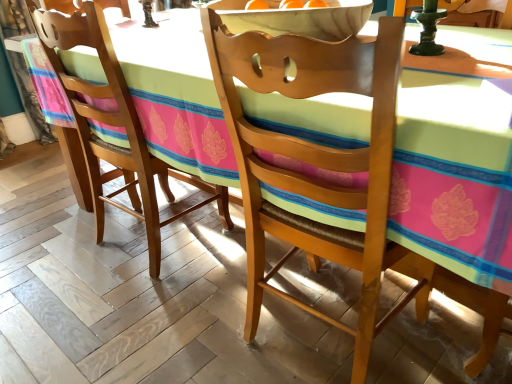
Question: From the image's perspective, is wooden chair at center, the 1th chair viewed from the right, located above or below matte wood chair at lower left, acting as the first chair starting from the left?

Choices:
 (A) above
 (B) below

Answer: (B)

Question: Relative to matte wood chair at lower left, the 2th chair in the right-to-left sequence, is wooden chair at center, the 2th chair viewed from the left, in front or behind?

Choices:
 (A) front
 (B) behind

Answer: (A)

Question: From a real-world perspective, is wooden chair at center, the 2th chair viewed from the left, physically located above or below matte wood chair at lower left, acting as the first chair starting from the left?

Choices:
 (A) above
 (B) below

Answer: (B)

Question: Is matte wood chair at lower left, the 2th chair in the right-to-left sequence, bigger or smaller than wooden chair at center, the 2th chair viewed from the left?

Choices:
 (A) small
 (B) big

Answer: (B)

Question: Is matte wood chair at lower left, acting as the first chair starting from the left, in front of or behind wooden chair at center, the 2th chair viewed from the left, in the image?

Choices:
 (A) front
 (B) behind

Answer: (B)

Question: Considering the positions of matte wood chair at lower left, acting as the first chair starting from the left, and wooden chair at center, the 1th chair viewed from the right, in the image, is matte wood chair at lower left, acting as the first chair starting from the left, wider or thinner than wooden chair at center, the 1th chair viewed from the right,?

Choices:
 (A) thin
 (B) wide

Answer: (B)

Question: From a real-world perspective, relative to wooden chair at center, the 2th chair viewed from the left, is matte wood chair at lower left, the 2th chair in the right-to-left sequence, vertically above or below?

Choices:
 (A) below
 (B) above

Answer: (B)